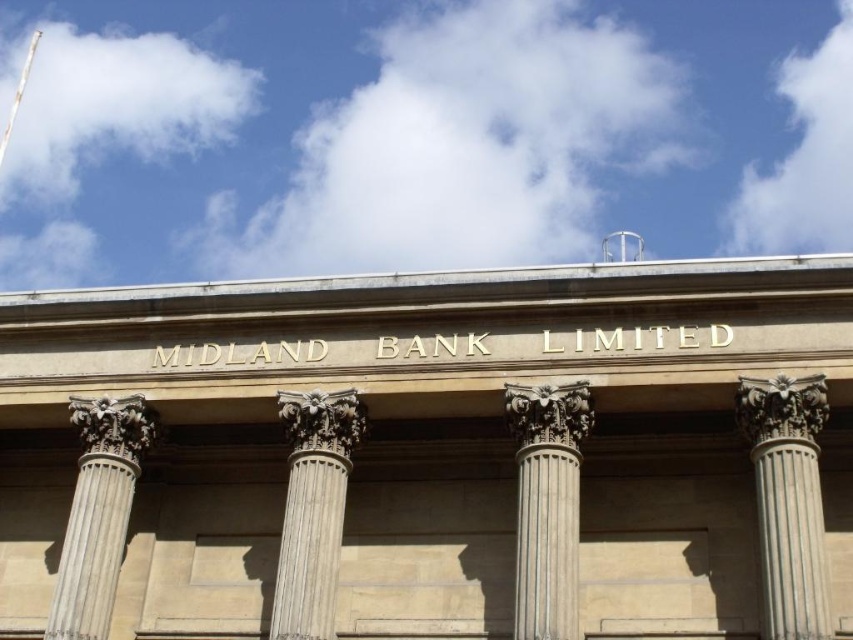
Question: Which object is positioned farthest from the white marble column at center?

Choices:
 (A) white stone column at right
 (B) gray stone column at center

Answer: (A)

Question: Which object is positioned farthest from the white stone column at right?

Choices:
 (A) white marble column at center
 (B) white stone column at left

Answer: (B)

Question: Considering the relative positions of white stone column at right and white stone column at left in the image provided, where is white stone column at right located with respect to white stone column at left?

Choices:
 (A) below
 (B) above

Answer: (B)

Question: Among these points, which one is farthest from the camera?

Choices:
 (A) (793, 637)
 (B) (103, 508)
 (C) (328, 634)
 (D) (554, 440)

Answer: (B)

Question: In this image, where is white stone column at right located relative to white marble column at center?

Choices:
 (A) above
 (B) below

Answer: (B)

Question: Does gray stone column at center lie in front of white marble column at center?

Choices:
 (A) no
 (B) yes

Answer: (B)